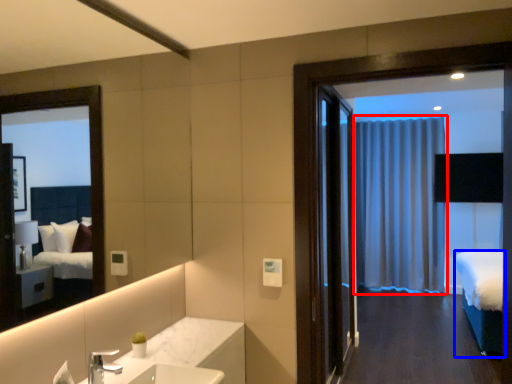
Question: Which of the following is the farthest to the observer, curtain (highlighted by a red box) or bed (highlighted by a blue box)?

Choices:
 (A) curtain
 (B) bed

Answer: (A)